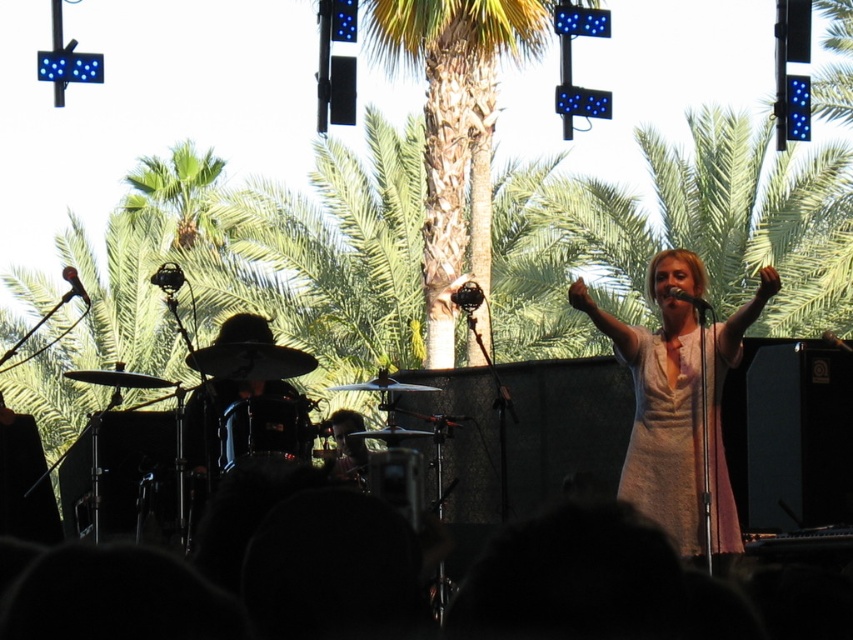
You are a photographer at the concert. You want to take a photo of the white matte dress at center and the black matte microphone at upper left. Which object should you focus on first if you need to capture the one that is taller?

The white matte dress at center is much taller than the black matte microphone at upper left, so you should focus on the white matte dress at center first.

You are a photographer standing at the camera position. You want to take a closeup shot of the white matte dress at center. The camera has a maximum zoom range of 5 meters. Can you capture the dress in focus without moving closer?

The white matte dress at center and camera are 7.33 meters apart, which exceeds the camera maximum zoom range of 5 meters. Therefore, you cannot capture the dress in focus without moving closer.